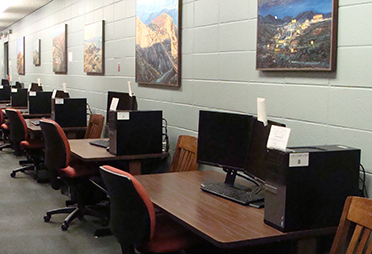
This screenshot has height=254, width=372. What are the coordinates of `desk` in the screenshot? It's located at (196, 196), (96, 155).